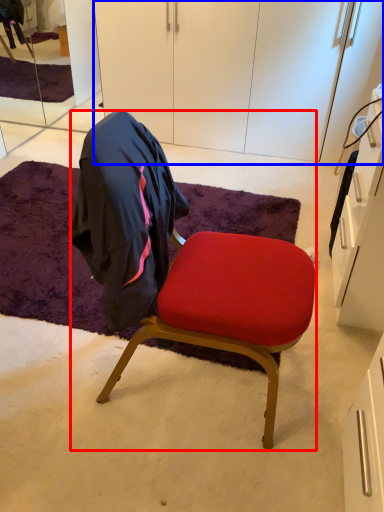
Question: Which object is closer to the camera taking this photo, chair (highlighted by a red box) or cabinetry (highlighted by a blue box)?

Choices:
 (A) chair
 (B) cabinetry

Answer: (A)